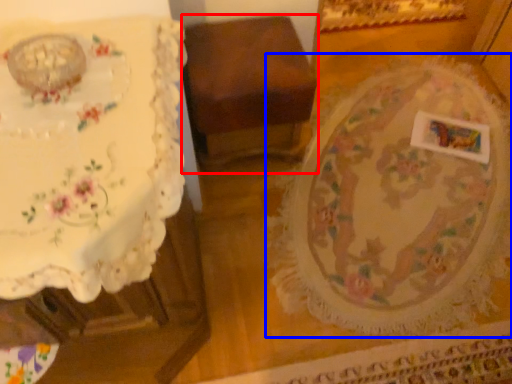
Question: Which point is closer to the camera, furniture (highlighted by a red box) or round table (highlighted by a blue box)?

Choices:
 (A) furniture
 (B) round table

Answer: (B)